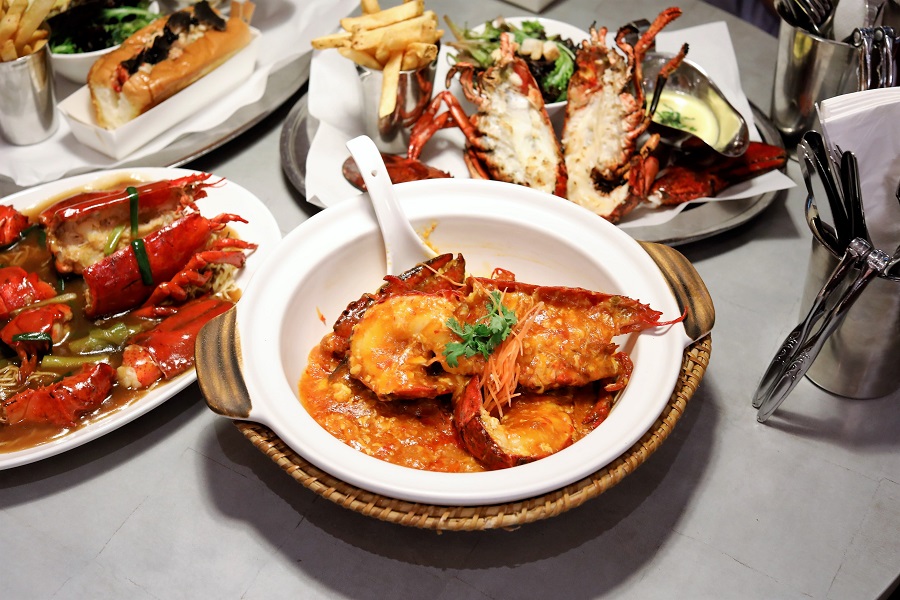
You are a GUI agent. You are given a task and a screenshot of the screen. Output one action in this format:
    pyautogui.click(x=<x>, y=<y>)
    Task: Click on the spoon
    The height and width of the screenshot is (600, 900).
    Given the screenshot: What is the action you would take?
    pyautogui.click(x=410, y=244)